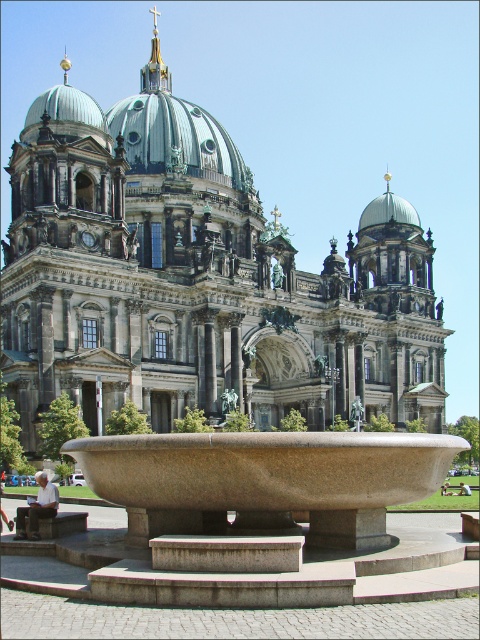
Is point (175, 157) positioned behind point (385, 202)?

No, it is not.

Between dark gray stone church at center and green copper dome at center, which one is positioned higher?

dark gray stone church at center is above.

The width and height of the screenshot is (480, 640). In order to click on dark gray stone church at center in this screenshot , I will do `click(195, 280)`.

Does brown stone fountain at center have a greater width compared to green copper dome at center?

Yes, brown stone fountain at center is wider than green copper dome at center.

Can you confirm if brown stone fountain at center is bigger than green copper dome at center?

Yes, brown stone fountain at center is bigger than green copper dome at center.

Where is `brown stone fountain at center`? brown stone fountain at center is located at coordinates (264, 481).

Where is `dark gray stone church at center`? The image size is (480, 640). dark gray stone church at center is located at coordinates (195, 280).

Can you confirm if dark gray stone church at center is taller than brown stone fountain at center?

Yes.

At what (x,y) coordinates should I click in order to perform the action: click on dark gray stone church at center. Please return your answer as a coordinate pair (x, y). Looking at the image, I should click on (195, 280).

The image size is (480, 640). I want to click on dark gray stone church at center, so click(195, 280).